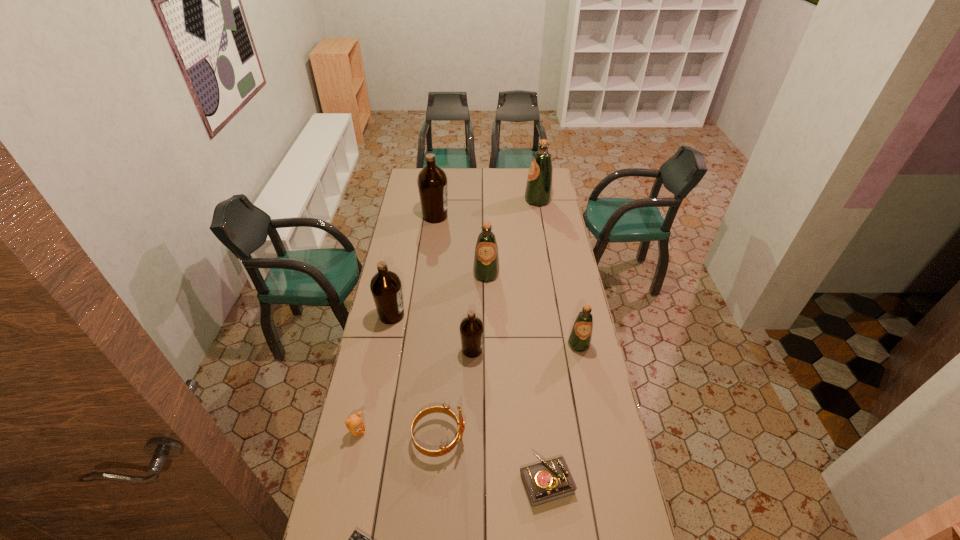
Image resolution: width=960 pixels, height=540 pixels. Find the location of `the biggest green olive oil`. the biggest green olive oil is located at coordinates (538, 192).

This screenshot has height=540, width=960. I want to click on the farthest object, so click(x=538, y=192).

Locate an element on the screen. the farthest brown olive oil is located at coordinates (432, 181).

The width and height of the screenshot is (960, 540). I want to click on the ninth nearest object, so (x=432, y=181).

Where is `the second smallest green olive oil`? the second smallest green olive oil is located at coordinates (486, 260).

Where is `the leftmost green olive oil`? The width and height of the screenshot is (960, 540). the leftmost green olive oil is located at coordinates (486, 260).

Image resolution: width=960 pixels, height=540 pixels. In order to click on the fourth farthest olive oil in this screenshot , I will do `click(386, 288)`.

This screenshot has width=960, height=540. What are the coordinates of `the second farthest brown olive oil` in the screenshot? It's located at (386, 288).

The height and width of the screenshot is (540, 960). What are the coordinates of `the smallest green olive oil` in the screenshot? It's located at (580, 338).

Image resolution: width=960 pixels, height=540 pixels. What are the coordinates of `the nearest brown olive oil` in the screenshot? It's located at (471, 328).